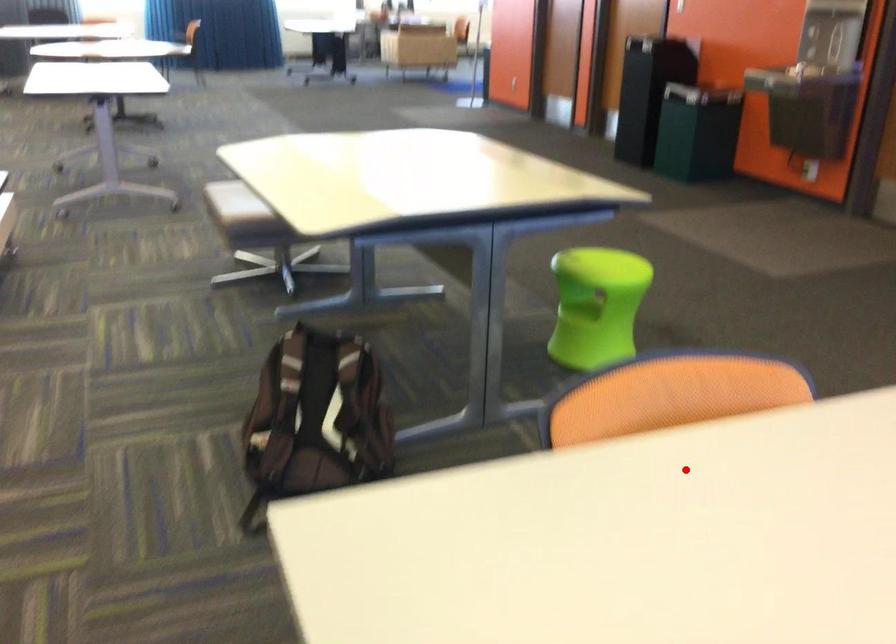
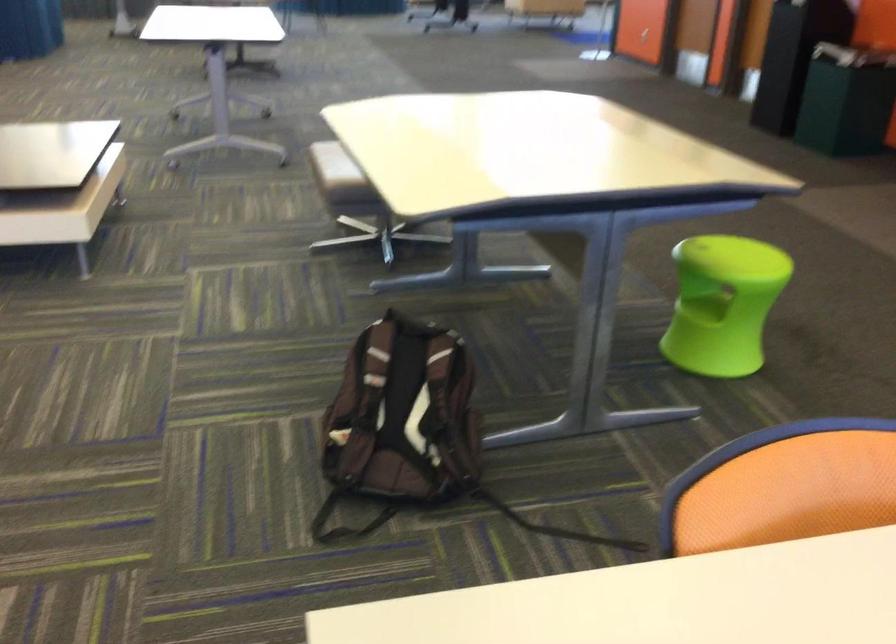
Find the pixel in the second image that matches the highlighted location in the first image.

(832, 585)